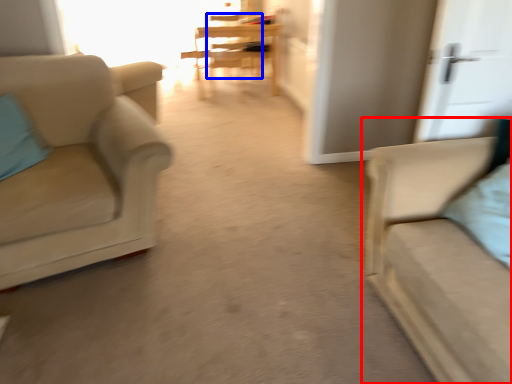
Question: Which of the following is the farthest to the observer, studio couch (highlighted by a red box) or armchair (highlighted by a blue box)?

Choices:
 (A) studio couch
 (B) armchair

Answer: (B)